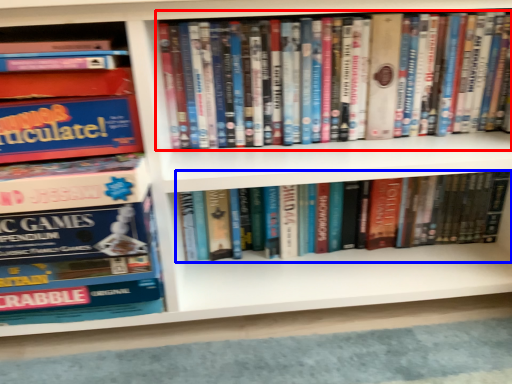
Question: Which point is further to the camera, book (highlighted by a red box) or book (highlighted by a blue box)?

Choices:
 (A) book
 (B) book

Answer: (B)